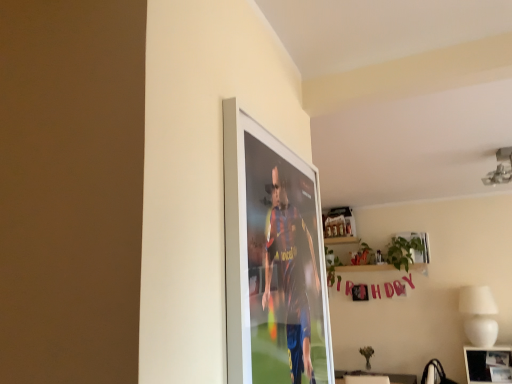
Question: From the image's perspective, is metallic silver photo frame at lower right, the first picture frame ordered from the bottom, on metallic silver picture frame at upper right, which is the first picture frame in left-to-right order?

Choices:
 (A) yes
 (B) no

Answer: (B)

Question: Is metallic silver photo frame at lower right, the 2th picture frame when ordered from top to bottom, shorter than metallic silver picture frame at upper right, which is the first picture frame in left-to-right order?

Choices:
 (A) no
 (B) yes

Answer: (A)

Question: Is metallic silver photo frame at lower right, which is the 1th picture frame from right to left, facing towards metallic silver picture frame at upper right, which is counted as the 2th picture frame, starting from the bottom?

Choices:
 (A) yes
 (B) no

Answer: (B)

Question: Is metallic silver photo frame at lower right, the first picture frame ordered from the bottom, facing away from metallic silver picture frame at upper right, the second picture frame positioned from the front?

Choices:
 (A) yes
 (B) no

Answer: (B)

Question: Considering the relative sizes of metallic silver photo frame at lower right, the first picture frame ordered from the bottom, and metallic silver picture frame at upper right, the second picture frame from the right, in the image provided, is metallic silver photo frame at lower right, the first picture frame ordered from the bottom, taller than metallic silver picture frame at upper right, the second picture frame from the right,?

Choices:
 (A) no
 (B) yes

Answer: (B)

Question: From a real-world perspective, is metallic silver photo frame at lower right, positioned as the first picture frame in front-to-back order, above or below green leafy plant at upper center?

Choices:
 (A) above
 (B) below

Answer: (B)

Question: Considering the positions of point (480, 354) and point (355, 256), is point (480, 354) closer or farther from the camera than point (355, 256)?

Choices:
 (A) closer
 (B) farther

Answer: (A)

Question: Is metallic silver photo frame at lower right, which ranks as the 2th picture frame in left-to-right order, to the left or to the right of green leafy plant at upper center in the image?

Choices:
 (A) left
 (B) right

Answer: (B)

Question: Considering the positions of metallic silver photo frame at lower right, the first picture frame ordered from the bottom, and green leafy plant at upper center in the image, is metallic silver photo frame at lower right, the first picture frame ordered from the bottom, wider or thinner than green leafy plant at upper center?

Choices:
 (A) wide
 (B) thin

Answer: (A)

Question: Is green leafy plant at upper center wider or thinner than metallic silver photo frame at lower right, the first picture frame ordered from the bottom?

Choices:
 (A) wide
 (B) thin

Answer: (B)

Question: Is point (330, 276) closer or farther from the camera than point (480, 367)?

Choices:
 (A) closer
 (B) farther

Answer: (B)

Question: From the image's perspective, is green leafy plant at upper center positioned above or below metallic silver photo frame at lower right, the 2th picture frame when ordered from top to bottom?

Choices:
 (A) above
 (B) below

Answer: (A)

Question: Is green leafy plant at upper center in front of or behind metallic silver photo frame at lower right, the first picture frame ordered from the bottom, in the image?

Choices:
 (A) behind
 (B) front

Answer: (A)

Question: From the image's perspective, relative to metallic silver picture frame at upper right, the second picture frame positioned from the front, is green leafy plant at upper center above or below?

Choices:
 (A) above
 (B) below

Answer: (B)

Question: Considering the positions of green leafy plant at upper center and metallic silver picture frame at upper right, which is counted as the 2th picture frame, starting from the bottom, in the image, is green leafy plant at upper center taller or shorter than metallic silver picture frame at upper right, which is counted as the 2th picture frame, starting from the bottom,?

Choices:
 (A) short
 (B) tall

Answer: (B)